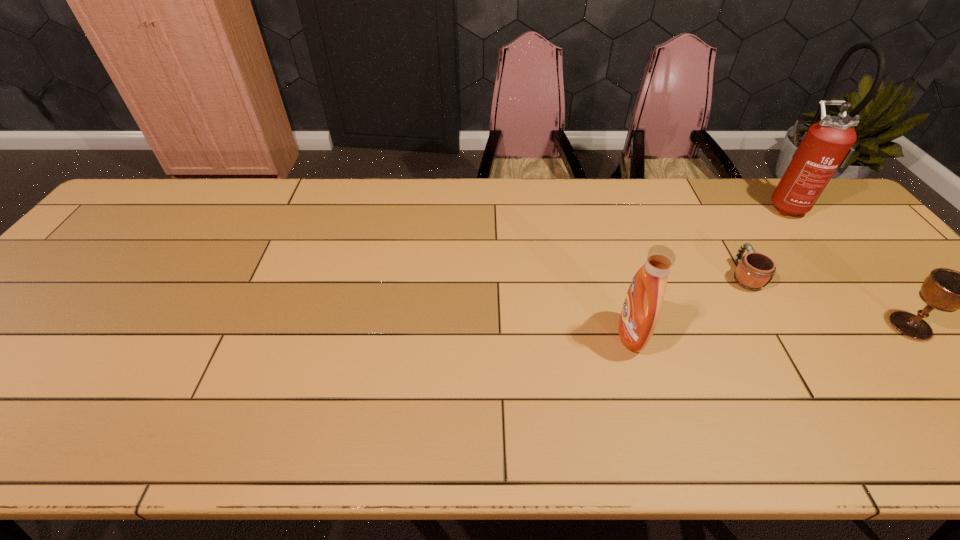
The height and width of the screenshot is (540, 960). I want to click on free space located 0.190m on the front-facing side of the third shortest object, so click(x=539, y=335).

You are a GUI agent. You are given a task and a screenshot of the screen. Output one action in this format:
    pyautogui.click(x=<x>, y=<y>)
    Task: Click on the free region located on the front-facing side of the third shortest object
    Image resolution: width=960 pixels, height=540 pixels.
    Given the screenshot: What is the action you would take?
    pyautogui.click(x=453, y=335)

Where is `vacant region located on the front-facing side of the third shortest object`? This screenshot has height=540, width=960. vacant region located on the front-facing side of the third shortest object is located at coordinates (513, 335).

Image resolution: width=960 pixels, height=540 pixels. I want to click on vacant space located 0.170m on the back of the chalice, so click(857, 263).

Locate an element on the screen. This screenshot has height=540, width=960. vacant point located 0.050m on the side of the shortest object with the handle is located at coordinates coord(728,247).

At what (x,y) coordinates should I click in order to perform the action: click on vacant space located on the side of the shortest object with the handle. Please return your answer as a coordinate pair (x, y). Looking at the image, I should click on (727, 245).

This screenshot has height=540, width=960. What are the coordinates of `free space located on the side of the shortest object with the handle` in the screenshot? It's located at (717, 230).

Where is `object that is at the far edge`? object that is at the far edge is located at coordinates (826, 145).

The height and width of the screenshot is (540, 960). I want to click on fire extinguisher situated at the right edge, so click(x=826, y=145).

You are a GUI agent. You are given a task and a screenshot of the screen. Output one action in this format:
    pyautogui.click(x=<x>, y=<y>)
    Task: Click on the chalice that is at the right edge
    This screenshot has height=540, width=960.
    Given the screenshot: What is the action you would take?
    pyautogui.click(x=947, y=290)